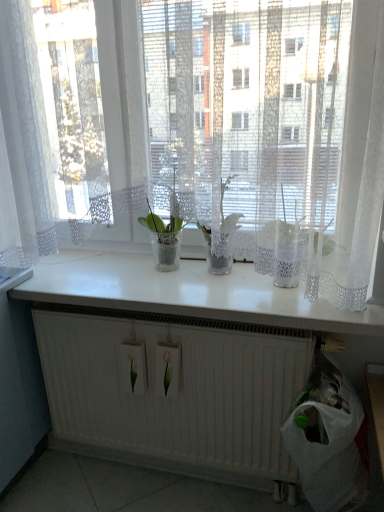
I want to click on free space in front of translucent glass vase at center, so click(161, 287).